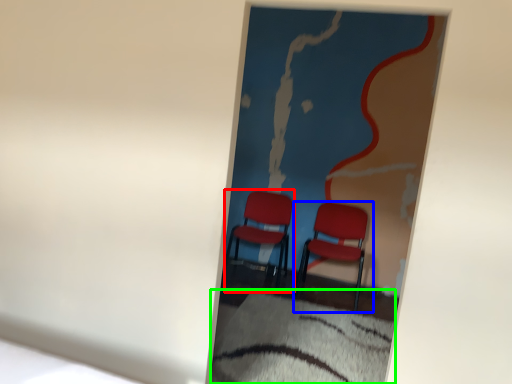
Question: Based on their relative distances, which object is nearer to chair (highlighted by a red box)? Choose from chair (highlighted by a blue box) and sheet (highlighted by a green box).

Choices:
 (A) chair
 (B) sheet

Answer: (A)